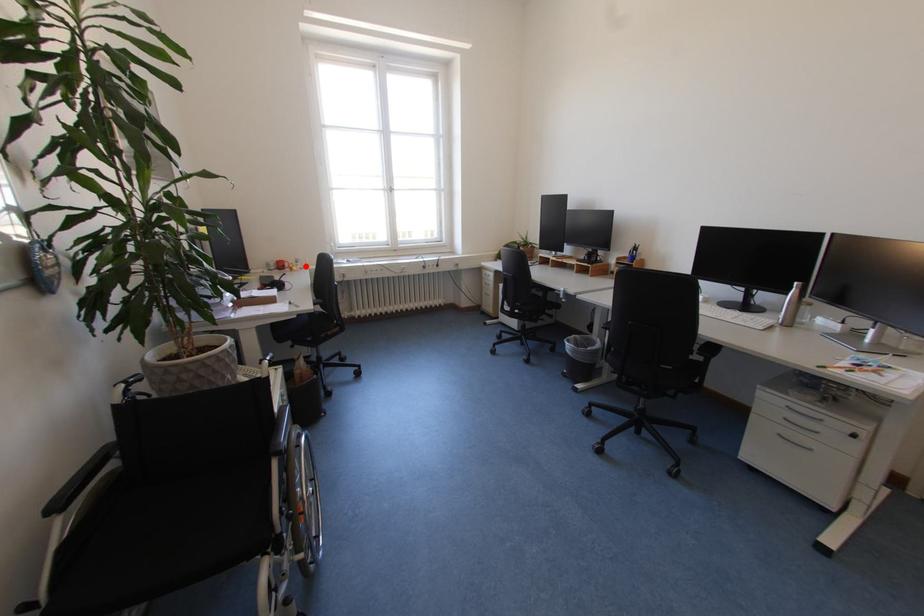
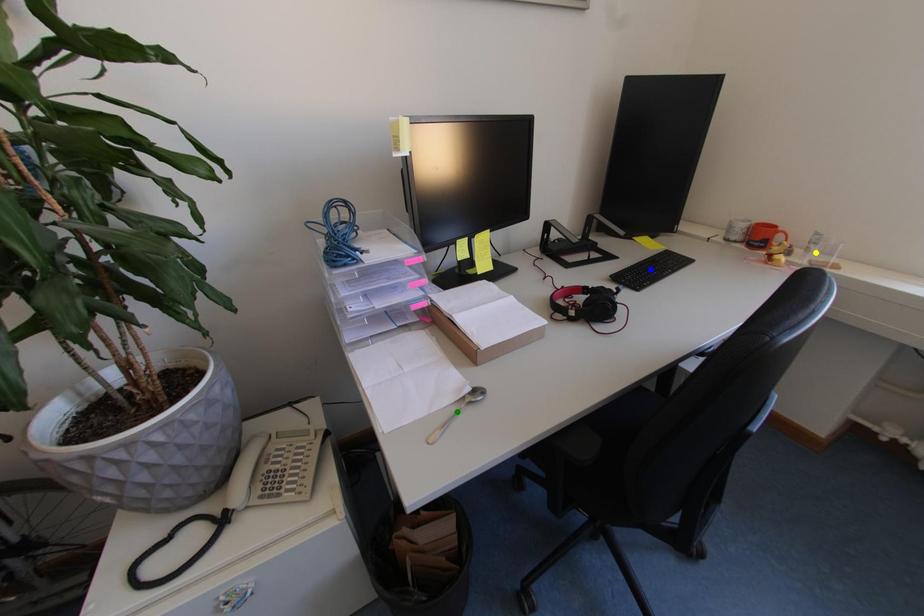
Question: I am providing you with two images of the same scene from different viewpoints. A red point is marked on the first image. You are given multiple points on the second image. Which mark in image 2 goes with the point in image 1?

Choices:
 (A) yellow point
 (B) green point
 (C) blue point

Answer: (A)